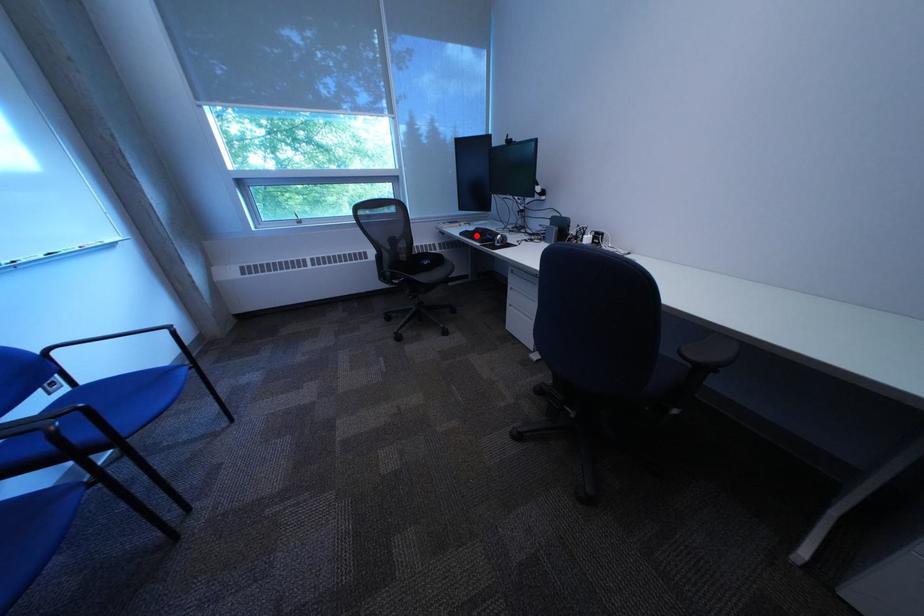
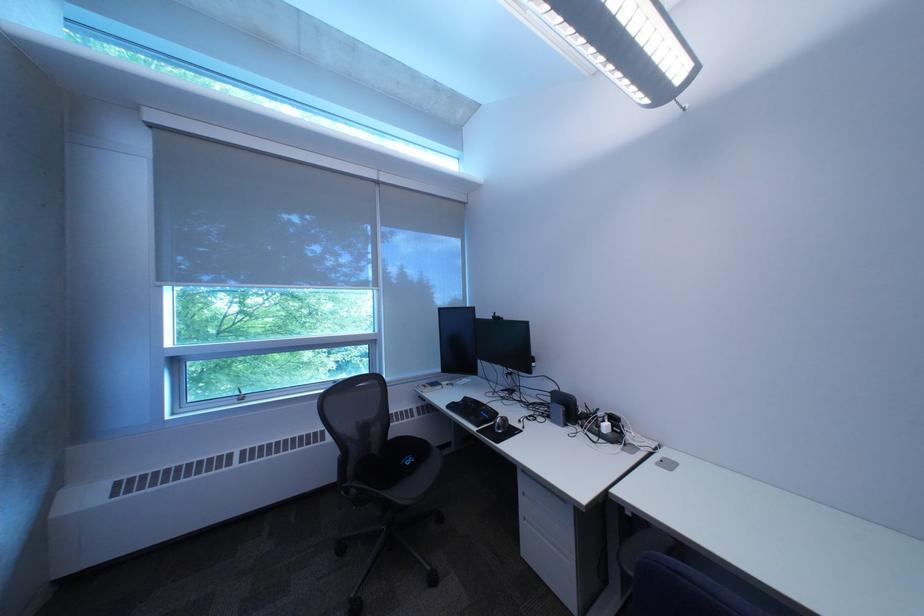
In the second image, find the point that corresponds to the highlighted location in the first image.

(464, 408)